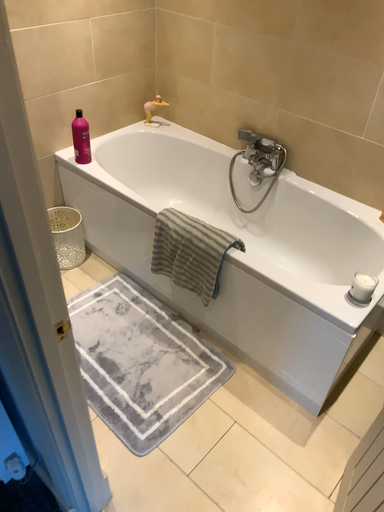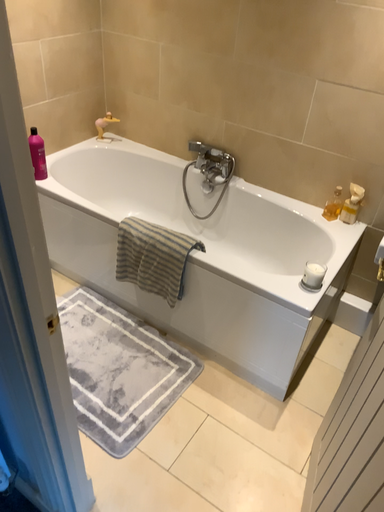
Question: Which way did the camera rotate in the video?

Choices:
 (A) rotated right
 (B) rotated left

Answer: (A)